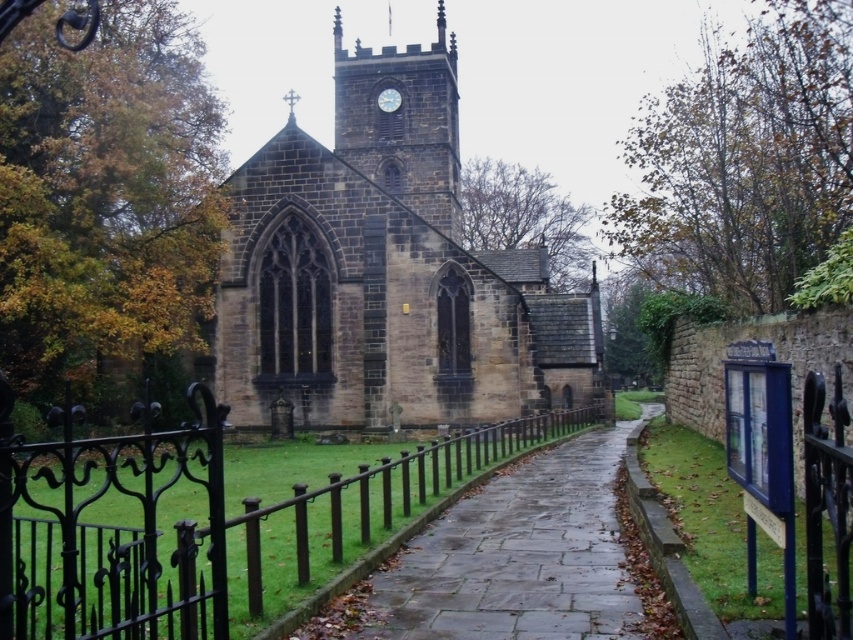
From the picture: Who is more forward, (349, 477) or (437, 609)?

Positioned in front is point (437, 609).

Can you confirm if black wrought iron fence at center is positioned above paved stone path at center?

Yes, black wrought iron fence at center is above paved stone path at center.

At what (x,y) coordinates should I click in order to perform the action: click on black wrought iron fence at center. Please return your answer as a coordinate pair (x, y). This screenshot has height=640, width=853. Looking at the image, I should click on (180, 520).

The width and height of the screenshot is (853, 640). Find the location of `black wrought iron fence at center`. black wrought iron fence at center is located at coordinates (180, 520).

Looking at this image, can you confirm if black wrought iron fence at center is wider than white stone clock at upper center?

Indeed, black wrought iron fence at center has a greater width compared to white stone clock at upper center.

Measure the distance between black wrought iron fence at center and white stone clock at upper center.

The distance of black wrought iron fence at center from white stone clock at upper center is 103.48 meters.

Which is behind, point (494, 458) or point (386, 104)?

The point (386, 104) is more distant.

Identify the location of black wrought iron fence at center. Image resolution: width=853 pixels, height=640 pixels. (180, 520).

Which is in front, point (433, 284) or point (149, 467)?

Point (149, 467) is more forward.

The height and width of the screenshot is (640, 853). What do you see at coordinates (386, 273) in the screenshot?
I see `dark stone church at center` at bounding box center [386, 273].

In the scene shown: Who is more distant from viewer, (316, 296) or (200, 580)?

The point (316, 296) is more distant.

You are a GUI agent. You are given a task and a screenshot of the screen. Output one action in this format:
    pyautogui.click(x=<x>, y=<y>)
    Task: Click on the dark stone church at center
    This screenshot has width=853, height=640.
    Given the screenshot: What is the action you would take?
    pyautogui.click(x=386, y=273)